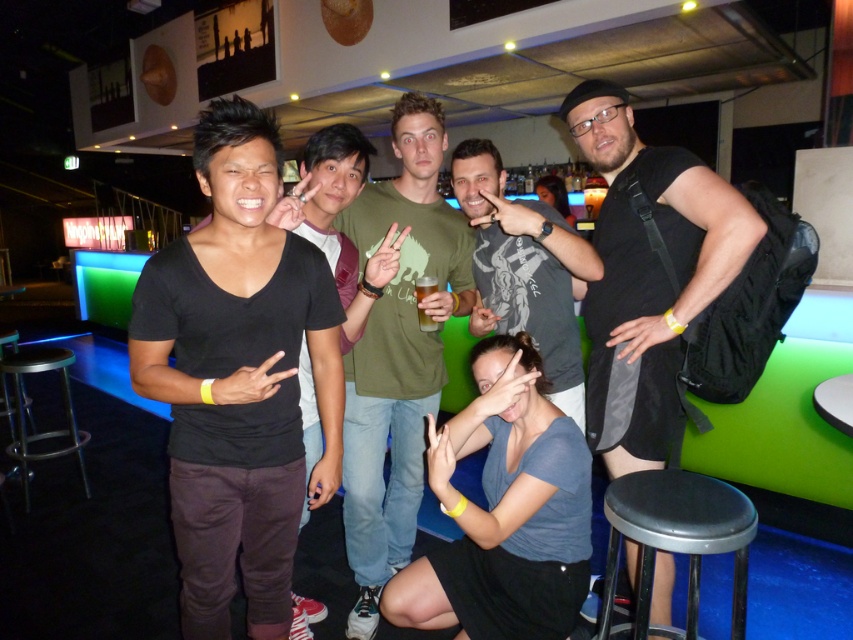
Who is positioned more to the right, black matte backpack at right or translucent plastic cup at center?

black matte backpack at right

How much distance is there between black matte backpack at right and translucent plastic cup at center?

black matte backpack at right is 60.16 centimeters from translucent plastic cup at center.

What do you see at coordinates (647, 273) in the screenshot? Image resolution: width=853 pixels, height=640 pixels. I see `black matte backpack at right` at bounding box center [647, 273].

Locate an element on the screen. This screenshot has width=853, height=640. black matte backpack at right is located at coordinates (647, 273).

Measure the distance between green matte shirt at center and camera.

green matte shirt at center is 1.82 meters from camera.

Which is in front, point (381, 188) or point (695, 589)?

Positioned in front is point (695, 589).

Who is more forward, (410, 552) or (675, 538)?

Point (675, 538) is more forward.

Find the location of a particular element. The height and width of the screenshot is (640, 853). green matte shirt at center is located at coordinates (398, 353).

Who is more forward, (683,195) or (440,264)?

Point (683,195) is more forward.

Can you confirm if black matte backpack at right is taller than green matte shirt at center?

In fact, black matte backpack at right may be shorter than green matte shirt at center.

The height and width of the screenshot is (640, 853). In order to click on black matte backpack at right in this screenshot , I will do `click(647, 273)`.